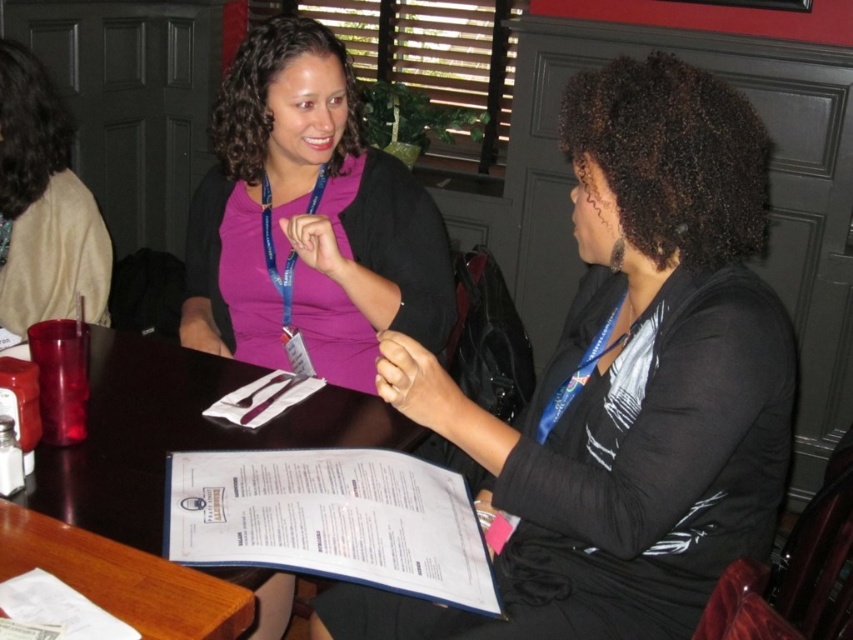
Who is positioned more to the right, white paper menu at center or beige fabric jacket at upper left?

Positioned to the right is white paper menu at center.

Which is behind, point (399, 508) or point (61, 202)?

The point (61, 202) is more distant.

Identify the location of white paper menu at center. This screenshot has height=640, width=853. (329, 518).

Does matte purple shirt at center appear under wooden table at center?

Actually, matte purple shirt at center is above wooden table at center.

Looking at this image, can you confirm if matte purple shirt at center is thinner than wooden table at center?

Indeed, matte purple shirt at center has a lesser width compared to wooden table at center.

What do you see at coordinates (308, 220) in the screenshot? The image size is (853, 640). I see `matte purple shirt at center` at bounding box center [308, 220].

This screenshot has width=853, height=640. What are the coordinates of `matte purple shirt at center` in the screenshot? It's located at (308, 220).

In the scene shown: Does matte black jacket at center appear on the left side of white paper menu at center?

Incorrect, matte black jacket at center is not on the left side of white paper menu at center.

Consider the image. Is matte black jacket at center shorter than white paper menu at center?

Answer: No.

Find the location of a particular element. matte black jacket at center is located at coordinates point(625,384).